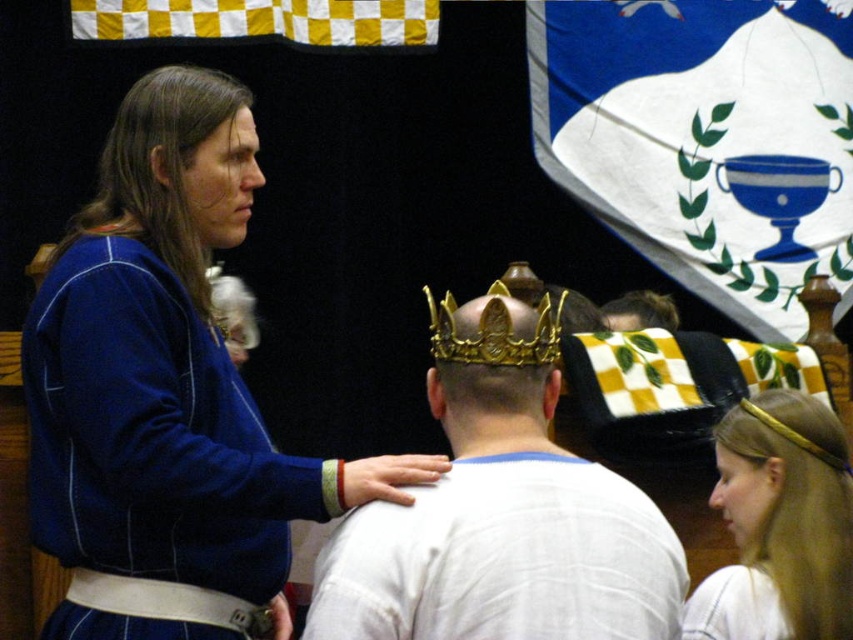
Question: Which object appears closest to the camera in this image?

Choices:
 (A) golden hairband at upper right
 (B) blue fleece robe at upper left
 (C) yellow and white checkered fabric at upper left

Answer: (B)

Question: Can you confirm if golden hairband at upper right is wider than gold metallic tiara at center?

Choices:
 (A) yes
 (B) no

Answer: (A)

Question: Is golden hairband at upper right to the right of shiny gold crown at center from the viewer's perspective?

Choices:
 (A) no
 (B) yes

Answer: (B)

Question: Which object is closer to the camera taking this photo?

Choices:
 (A) matte blue hair at upper left
 (B) shiny gold crown at center

Answer: (A)

Question: Which object is closer to the camera taking this photo?

Choices:
 (A) gold metallic tiara at center
 (B) shiny gold crown at center
 (C) gold metallic crown at center

Answer: (C)

Question: Does blue fabric flag at upper right have a smaller size compared to golden hairband at upper right?

Choices:
 (A) yes
 (B) no

Answer: (B)